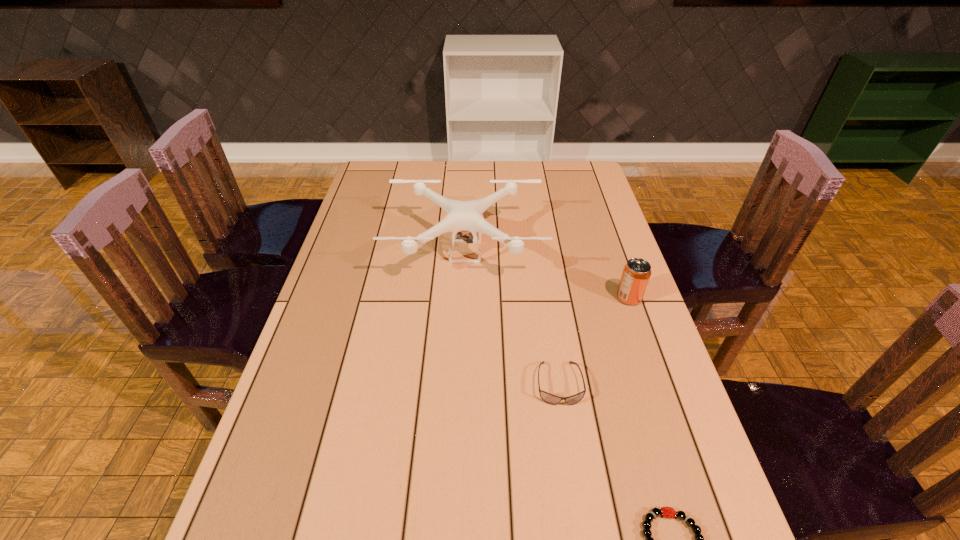
Select which object is the third closest to the bracelet. Please provide its 2D coordinates. Your answer should be formatted as a tuple, i.e. [(x, y)], where the tuple contains the x and y coordinates of a point satisfying the conditions above.

[(462, 216)]

Where is `free location that satisfies the following two spatial constraints: 1. on the top of the farthest object; 2. on the right side of the soda can`? The height and width of the screenshot is (540, 960). free location that satisfies the following two spatial constraints: 1. on the top of the farthest object; 2. on the right side of the soda can is located at coordinates (464, 298).